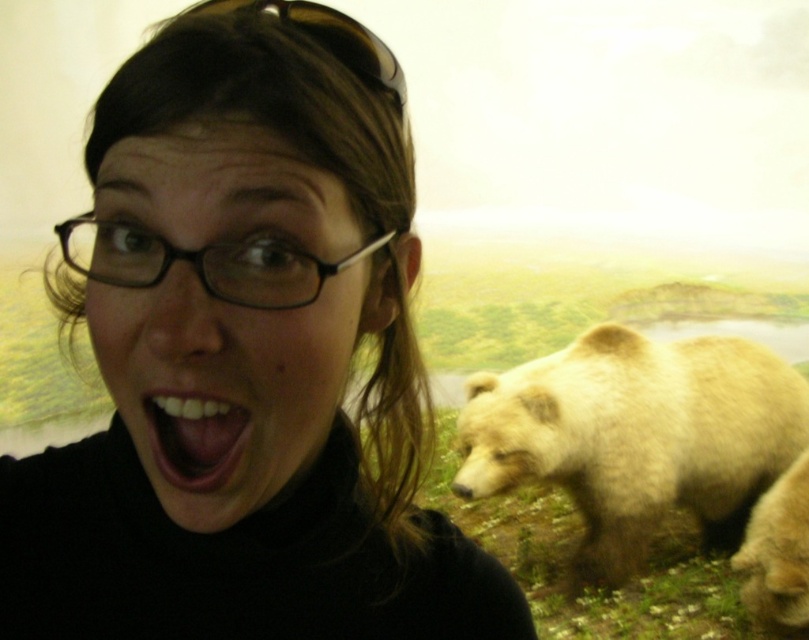
Can you confirm if white glossy teeth at center is taller than black plastic sunglasses at upper center?

No, white glossy teeth at center is not taller than black plastic sunglasses at upper center.

Can you confirm if white glossy teeth at center is thinner than black plastic sunglasses at upper center?

Correct, white glossy teeth at center's width is less than black plastic sunglasses at upper center's.

What are the coordinates of `white glossy teeth at center` in the screenshot? It's located at (193, 436).

I want to click on white glossy teeth at center, so click(x=193, y=436).

Looking at this image, does black matte turtleneck at upper left have a larger size compared to white glossy teeth at center?

Indeed, black matte turtleneck at upper left has a larger size compared to white glossy teeth at center.

Does black matte turtleneck at upper left have a lesser width compared to white glossy teeth at center?

Incorrect, black matte turtleneck at upper left's width is not less than white glossy teeth at center's.

Which is in front, point (270, 28) or point (183, 474)?

Positioned in front is point (183, 474).

The height and width of the screenshot is (640, 809). I want to click on black matte turtleneck at upper left, so click(246, 360).

Can you confirm if fuzzy brown bear at right is wider than black plastic sunglasses at upper center?

Yes.

Describe the element at coordinates (777, 554) in the screenshot. The height and width of the screenshot is (640, 809). I see `fuzzy brown bear at right` at that location.

This screenshot has height=640, width=809. I want to click on fuzzy brown bear at right, so click(x=777, y=554).